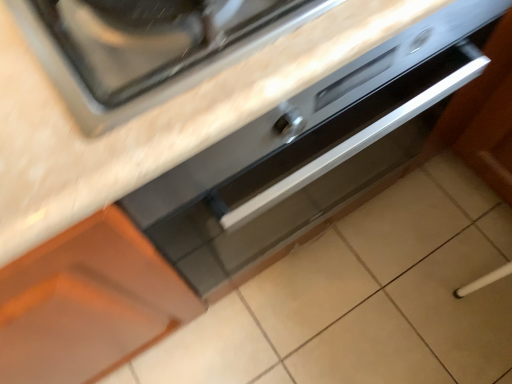
I want to click on free area below beige ceramic tile at lower right (from a real-world perspective), so click(x=476, y=333).